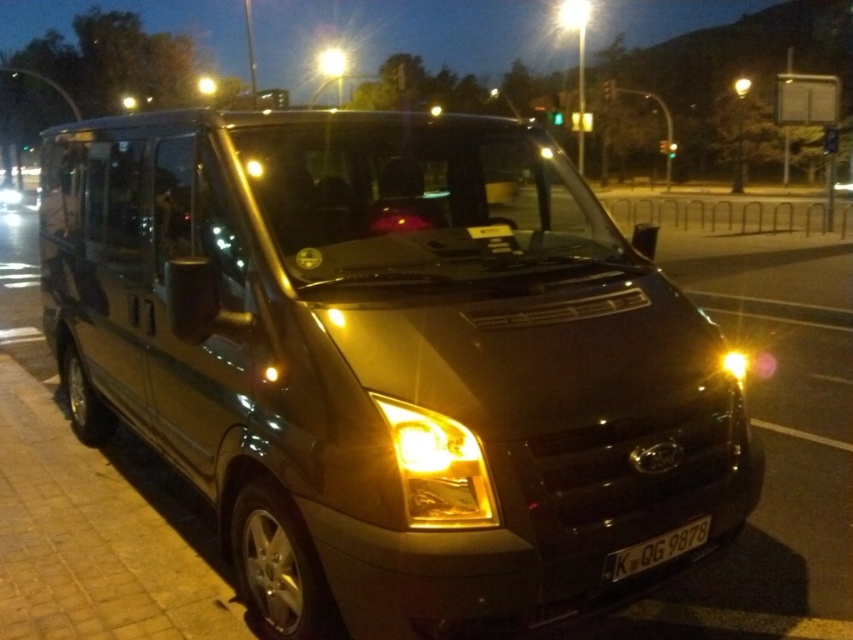
Question: Is metallic gold van at center positioned before black plastic license plate at lower center?

Choices:
 (A) no
 (B) yes

Answer: (B)

Question: Can you confirm if metallic gold van at center is bigger than matte gold headlight at center?

Choices:
 (A) yes
 (B) no

Answer: (A)

Question: Which of the following is the closest to the observer?

Choices:
 (A) black plastic license plate at lower center
 (B) matte gold headlight at center
 (C) metallic gold van at center
 (D) yellow translucent headlight at center

Answer: (C)

Question: Which point appears farthest from the camera in this image?

Choices:
 (A) (248, 353)
 (B) (732, 353)
 (C) (482, 474)
 (D) (660, 563)

Answer: (B)

Question: Based on their relative distances, which object is nearer to the matte gold headlight at center?

Choices:
 (A) yellow translucent headlight at center
 (B) metallic gold van at center

Answer: (A)

Question: From the image, what is the correct spatial relationship of black plastic license plate at lower center in relation to matte gold headlight at center?

Choices:
 (A) below
 (B) above

Answer: (A)